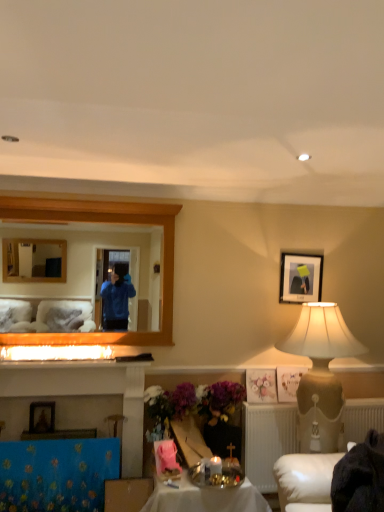
You are a GUI agent. You are given a task and a screenshot of the screen. Output one action in this format:
    pyautogui.click(x=<x>, y=<y>)
    Task: Click on the vacant space situated above wooden frame mirror at upper left (from a real-world perspective)
    The height and width of the screenshot is (512, 384).
    Given the screenshot: What is the action you would take?
    pyautogui.click(x=102, y=198)